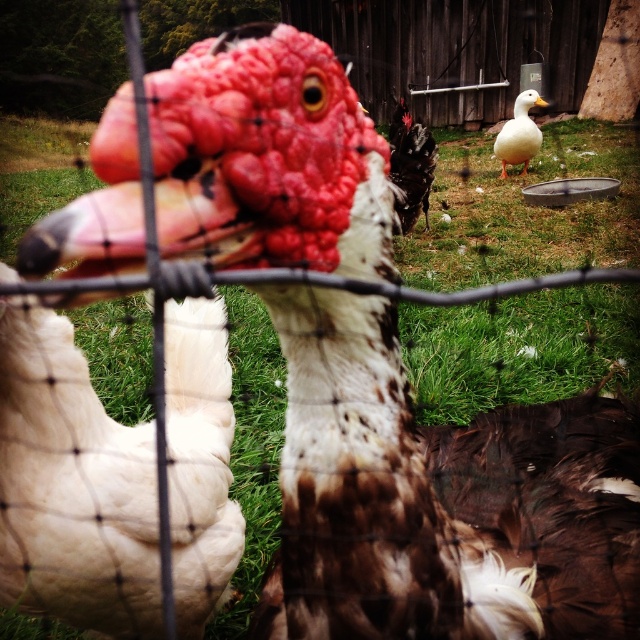
You are a farmer checking the fence for gaps. You notice the white fluffy chicken at left and the white matte duck at upper right. Which bird is taller?

The white fluffy chicken at left is not as tall as the white matte duck at upper right, so the white matte duck at upper right is taller.

You are a farmer standing at the center of the field. You need to collect eggs from the white fluffy chicken at left and the white matte duck at upper right. Which bird is closer to you?

The white fluffy chicken at left is 6.36 meters away from the white matte duck at upper right, so the white fluffy chicken at left is closer to you.